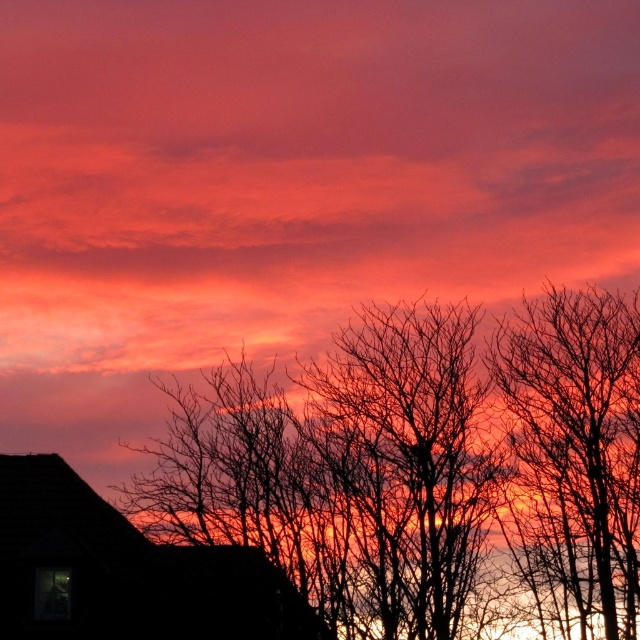
In the sunset scene, there are two elements against the vibrant sky. The silhouette bare tree at center and the bare branches at right. Which one is positioned more to the left?

The silhouette bare tree at center is positioned more to the left than the bare branches at right.

You are an artist sketching this sunset scene. You want to ensure the silhouette bare tree at center and the bare branches at right are proportionally accurate. Which object should you draw taller?

The silhouette bare tree at center should be drawn taller than the bare branches at right as it has a greater height compared to them according to the description.

You are a painter standing at the center of the scene. You want to paint the silhouette bare tree at center. Where should you look to find it?

The silhouette bare tree at center is located at the point with coordinates 0.733 on the x axis and 0.666 on the y axis.